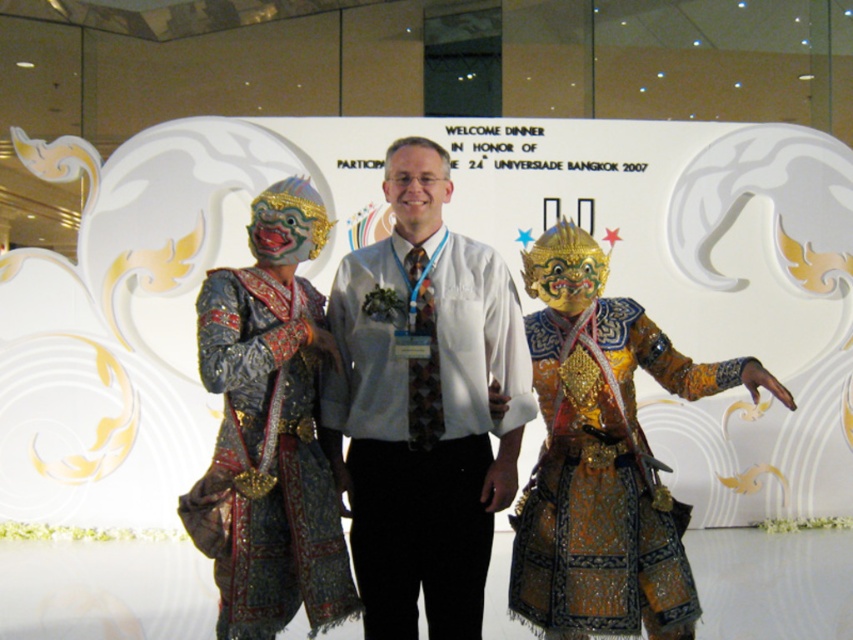
You are a photographer at the Welcome Dinner event. You need to adjust the lighting so that the white shirt at center and the gold sequined robe at center are both well illuminated. Which object should you focus the light on first to ensure both are properly lit?

The white shirt at center is above the gold sequined robe at center, so focusing the light on the white shirt at center first will ensure that both objects receive adequate illumination.

In the scene shown: You are standing at the Welcome Dinner event and want to take a photo of the point located at coordinate point (515, 376). Can you estimate how far you need to move forward to capture this point in your camera frame?

The point at coordinate point (515, 376) is 4.28 meters away from the viewer, so you need to move forward 4.28 meters to capture it in your camera frame.

You are a photographer at the Welcome Dinner event. You need to position a spotlight to the right of both the metallic fabric costumes at center and the gold metallic mask at center. Is this possible given their arrangement?

The metallic fabric costumes at center are to the left of the gold metallic mask at center, so positioning a spotlight to the right of both is possible as there is space to the right of the mask.